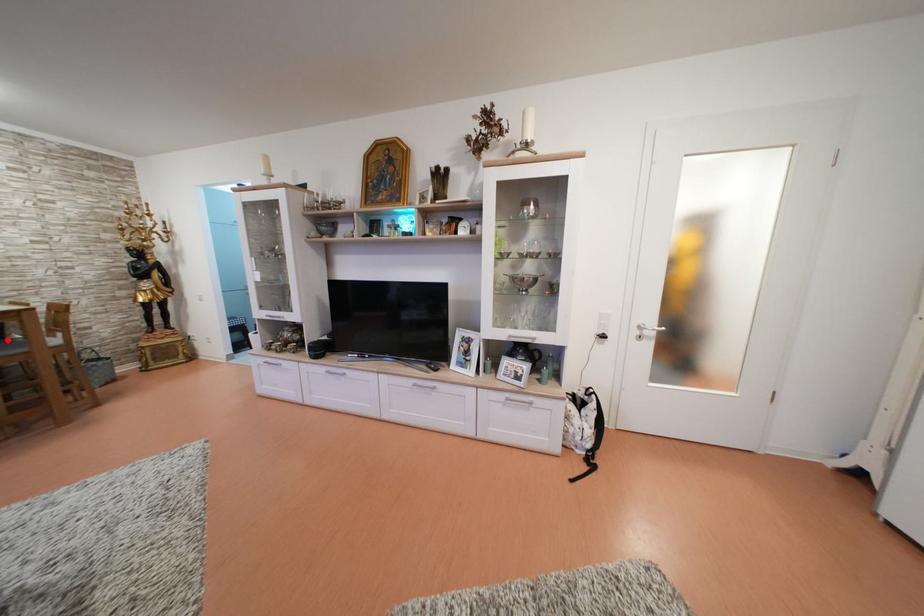
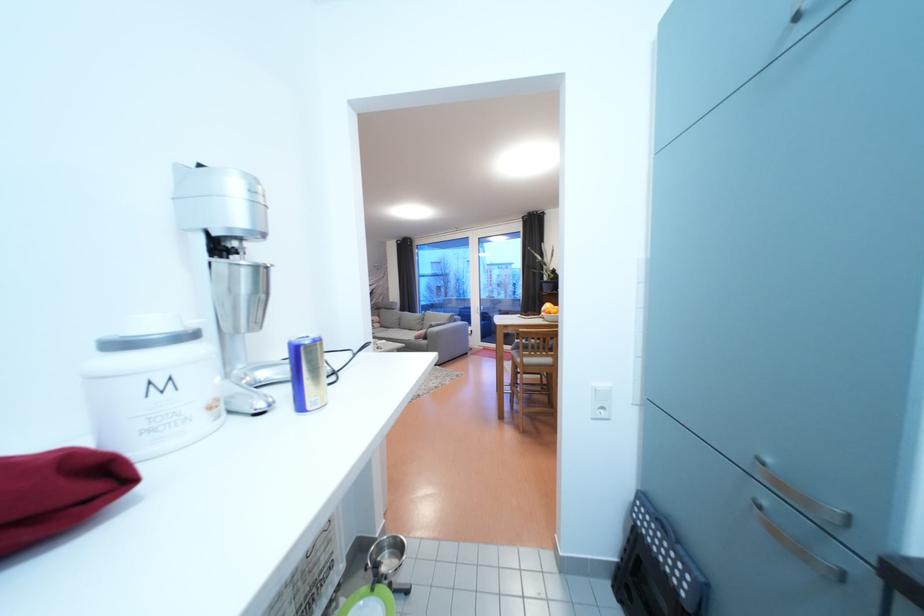
Question: I am providing you with two images of the same scene from different viewpoints. A red point is marked on the first image. Can you still see the location of the red point in image 2?

Choices:
 (A) Yes
 (B) No

Answer: (B)